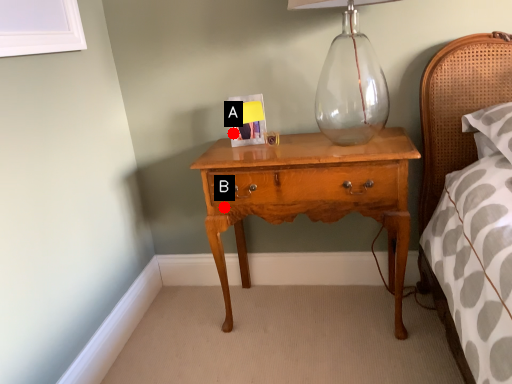
Question: Two points are circled on the image, labeled by A and B beside each circle. Which point appears closest to the camera in this image?

Choices:
 (A) A is closer
 (B) B is closer

Answer: (B)